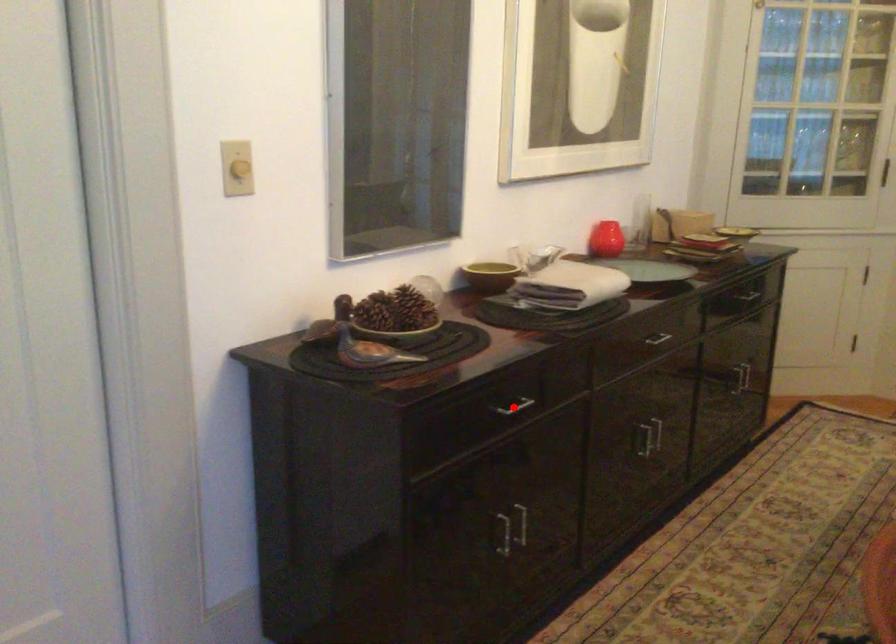
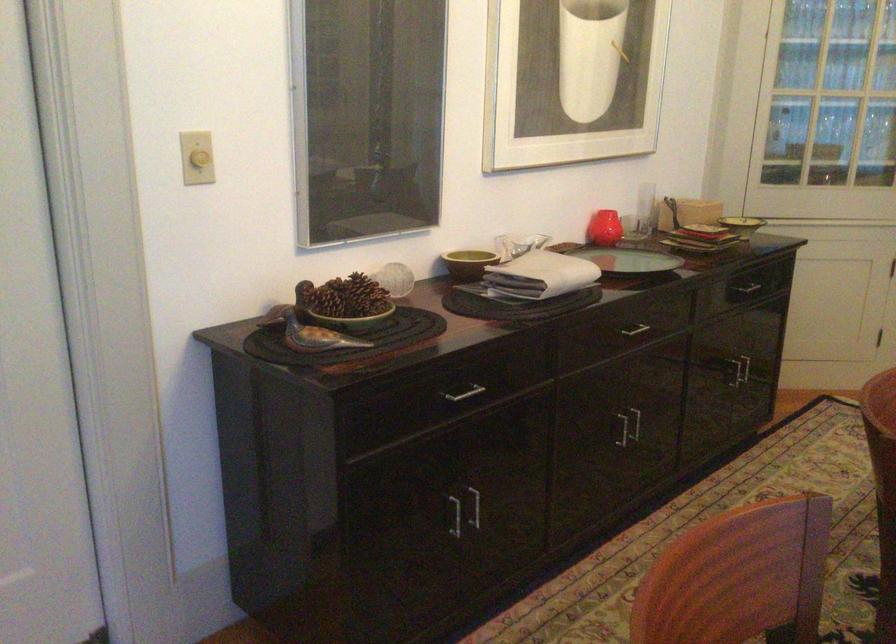
In the second image, find the point that corresponds to the highlighted location in the first image.

(462, 393)